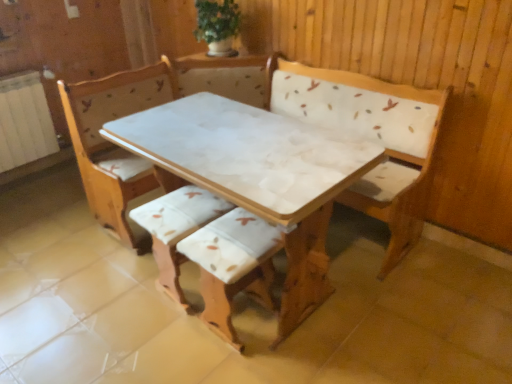
Where is `unoccupied region to the right of white marble table at center`? The image size is (512, 384). unoccupied region to the right of white marble table at center is located at coordinates pyautogui.click(x=426, y=313).